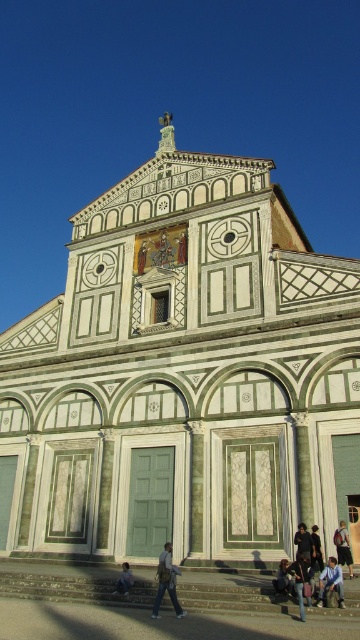
In the scene shown: Can you confirm if dark brown leather jacket at lower center is wider than dark blue jeans at lower center?

Yes, dark brown leather jacket at lower center is wider than dark blue jeans at lower center.

Can you confirm if dark brown leather jacket at lower center is smaller than dark blue jeans at lower center?

Yes.

Who is more forward, (x=311, y=561) or (x=320, y=561)?

Point (x=311, y=561) is in front.

I want to click on dark brown leather jacket at lower center, so 303,541.

Does white marble church at center appear over dark brown leather jacket at lower center?

Indeed, white marble church at center is positioned over dark brown leather jacket at lower center.

Is white marble church at center shorter than dark brown leather jacket at lower center?

In fact, white marble church at center may be taller than dark brown leather jacket at lower center.

Is point (19, 323) in front of point (295, 540)?

No, (19, 323) is behind (295, 540).

Identify the location of white marble church at center. This screenshot has height=640, width=360. (183, 376).

Does point (87, 550) come closer to viewer compared to point (307, 564)?

No, it is not.

Is white marble church at center closer to the viewer compared to jeans at lower center?

No, white marble church at center is behind jeans at lower center.

Find the location of a particular element. The height and width of the screenshot is (640, 360). white marble church at center is located at coordinates (183, 376).

The image size is (360, 640). I want to click on white marble church at center, so click(183, 376).